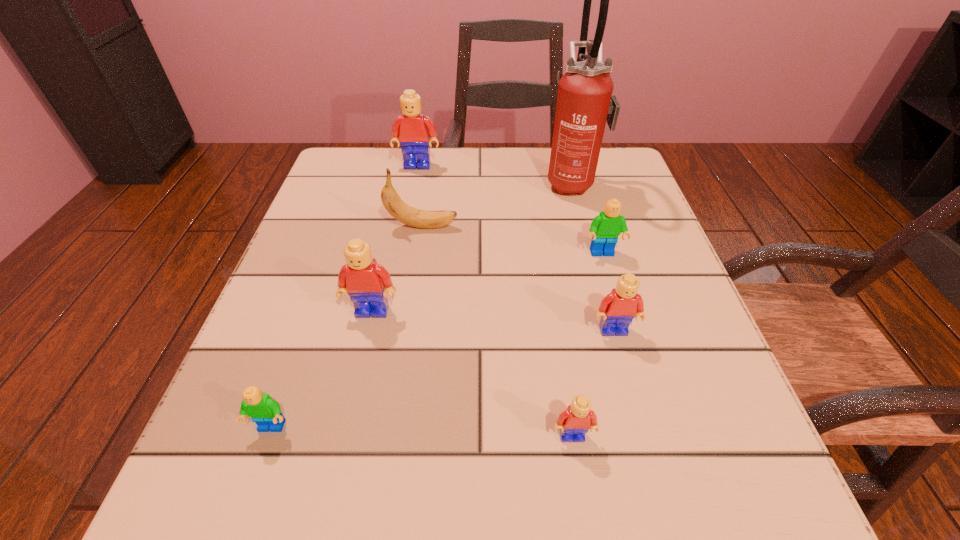
Identify the location of the farther green Lego. This screenshot has width=960, height=540. (605, 228).

Where is `the nearest yellow Lego`? This screenshot has height=540, width=960. the nearest yellow Lego is located at coordinates (574, 422).

Image resolution: width=960 pixels, height=540 pixels. Identify the location of the third yellow Lego from left to right. (574, 422).

You are a GUI agent. You are given a task and a screenshot of the screen. Output one action in this format:
    pyautogui.click(x=<x>, y=<y>)
    Task: Click on the nearer green Lego
    
    Given the screenshot: What is the action you would take?
    pyautogui.click(x=264, y=411)

Where is `the leftmost Lego`? the leftmost Lego is located at coordinates (264, 411).

The width and height of the screenshot is (960, 540). I want to click on vacant space located 0.130m at the nozzle of the fire extinguisher, so click(489, 182).

What are the coordinates of `free space located 0.170m at the nozzle of the fire extinguisher` in the screenshot? It's located at (471, 182).

Locate an element on the screen. The width and height of the screenshot is (960, 540). free space located 0.110m at the nozzle of the fire extinguisher is located at coordinates (497, 182).

Image resolution: width=960 pixels, height=540 pixels. Identify the location of free space located 0.110m on the front-facing side of the farthest yellow Lego. (412, 197).

Locate an element on the screen. vacant space located on the front-facing side of the fifth farthest object is located at coordinates (328, 509).